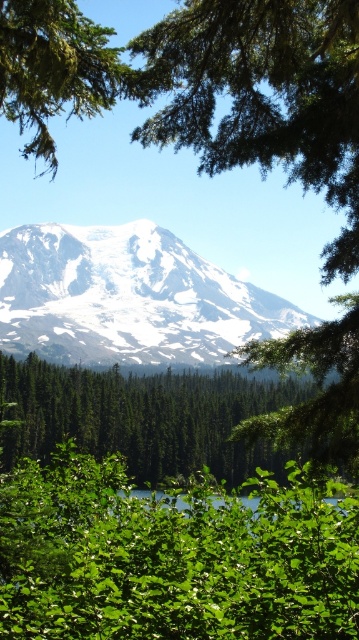
You are standing in the forest looking at the mountain. There are two points marked in the image, one at point coordinates (x=263, y=291) and the other at point coordinates (x=19, y=65). Which point is closer to you?

Point (x=19, y=65) is closer to you because it is nearer than point (x=263, y=291) which is further away.